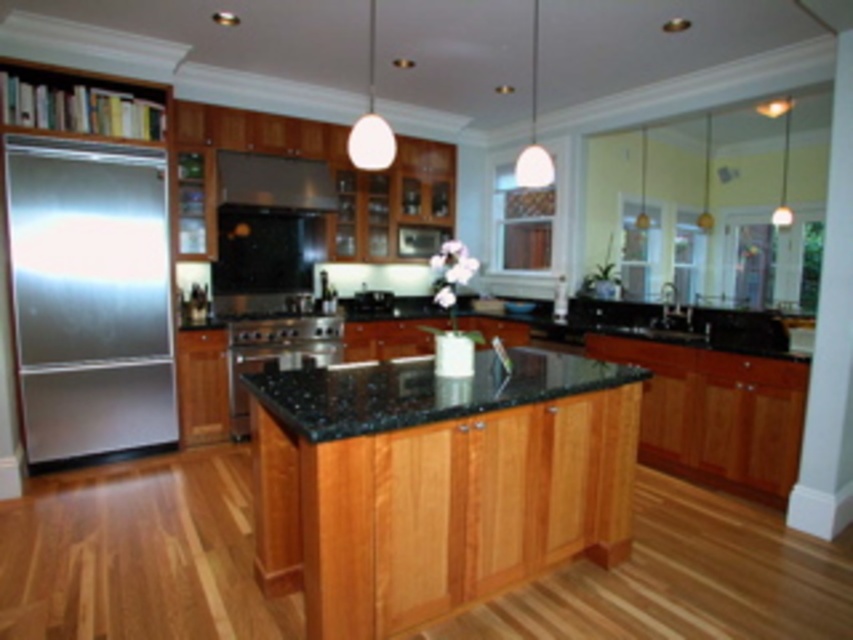
You are a chef preparing to set up a workstation in the kitchen. You have a tall mixing bowl that requires a surface at least 90 cm in height. Can you place it on the natural wood island at center or the black granite sink at center?

The natural wood island at center is much taller than the black granite sink at center. Since the mixing bowl requires a surface at least 90 cm in height, you should place it on the natural wood island at center as it is taller and more likely to meet the height requirement.

You are a chef preparing to install a new kitchen appliance. You have a stainless steel refrigerator at left and a satin black exhaust hood at upper center. Which appliance is positioned higher in the kitchen?

The satin black exhaust hood at upper center is positioned higher than the stainless steel refrigerator at left.